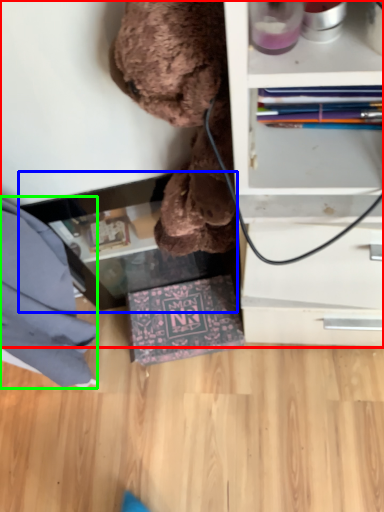
Question: Considering the real-world distances, which object is farthest from shelf (highlighted by a red box)? table (highlighted by a blue box) or clothe (highlighted by a green box)?

Choices:
 (A) table
 (B) clothe

Answer: (B)